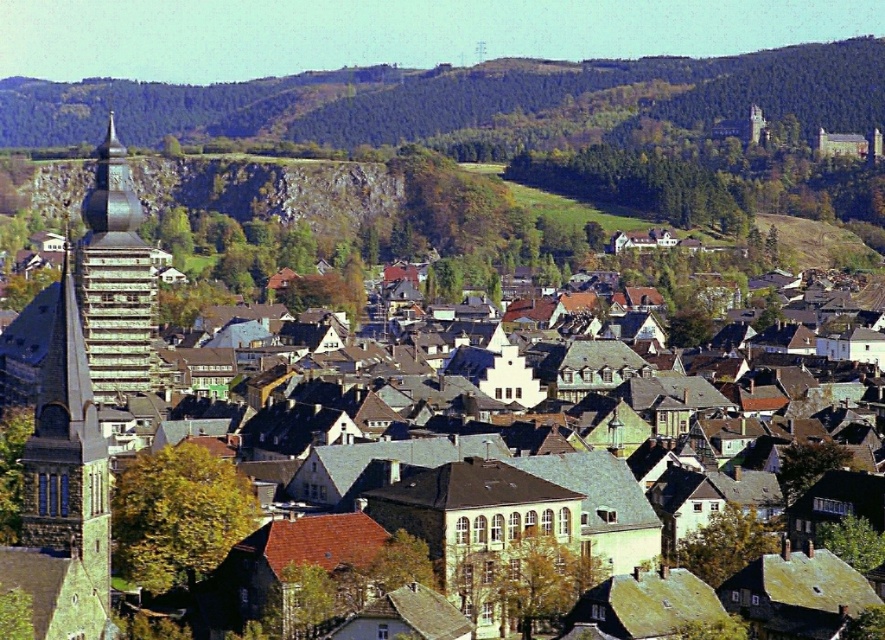
Question: Is green stone church steeple at left positioned in front of green glass tower at left?

Choices:
 (A) yes
 (B) no

Answer: (A)

Question: Does green forested hill at upper center appear under green glass tower at left?

Choices:
 (A) no
 (B) yes

Answer: (A)

Question: Which point is farther to the camera?

Choices:
 (A) (72, 371)
 (B) (706, 84)

Answer: (B)

Question: Among these points, which one is farthest from the camera?

Choices:
 (A) (29, 448)
 (B) (102, 285)

Answer: (B)

Question: Does green stone church steeple at left appear on the left side of green glass tower at left?

Choices:
 (A) no
 (B) yes

Answer: (A)

Question: Which object appears closest to the camera in this image?

Choices:
 (A) green glass tower at left
 (B) green forested hill at upper center
 (C) green stone church steeple at left

Answer: (C)